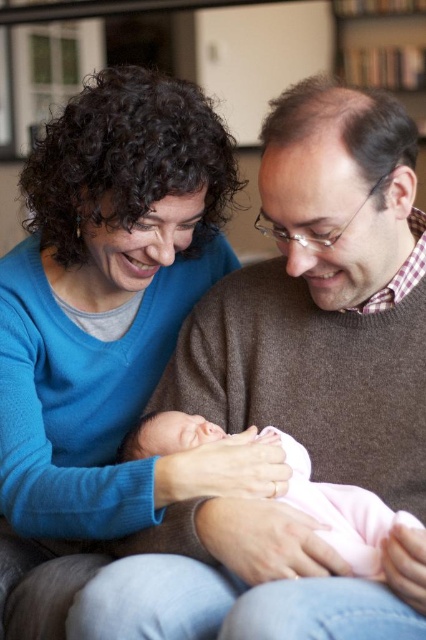
Looking at this image, is blue sweater at upper left taller than pink soft fabric newborn at center?

Indeed, blue sweater at upper left has a greater height compared to pink soft fabric newborn at center.

Between blue sweater at upper left and pink soft fabric newborn at center, which one has less height?

Standing shorter between the two is pink soft fabric newborn at center.

Image resolution: width=426 pixels, height=640 pixels. I want to click on blue sweater at upper left, so click(x=104, y=296).

Looking at this image, does brown sweater at center have a greater height compared to wooden bookshelf at upper center?

In fact, brown sweater at center may be shorter than wooden bookshelf at upper center.

Is point (198, 632) less distant than point (362, 28)?

Yes, point (198, 632) is in front of point (362, 28).

At what (x,y) coordinates should I click in order to perform the action: click on brown sweater at center. Please return your answer as a coordinate pair (x, y). Looking at the image, I should click on (325, 300).

Is brown sweater at center in front of pink soft fabric newborn at center?

Yes, it is in front of pink soft fabric newborn at center.

Is point (333, 618) closer to viewer compared to point (373, 531)?

Yes, it is in front of point (373, 531).

Where is `brown sweater at center`? This screenshot has height=640, width=426. brown sweater at center is located at coordinates (325, 300).